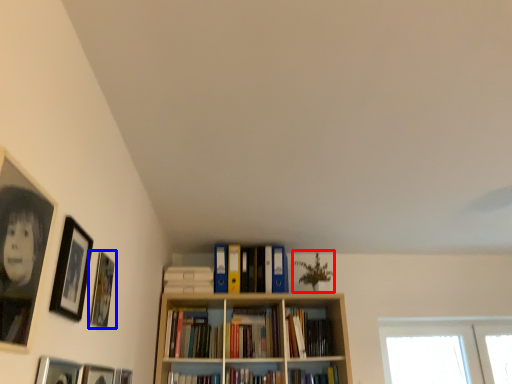
Question: Which point is further to the camera, plant (highlighted by a red box) or picture frame (highlighted by a blue box)?

Choices:
 (A) plant
 (B) picture frame

Answer: (A)